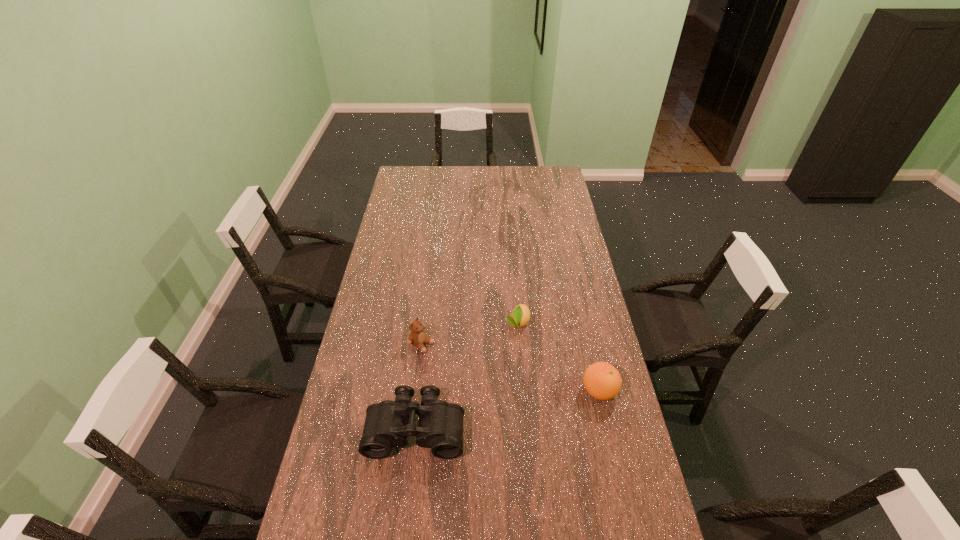
This screenshot has width=960, height=540. Find the location of `vacant area located 0.240m with leaves positioned above the shortest object`. vacant area located 0.240m with leaves positioned above the shortest object is located at coordinates (503, 388).

The image size is (960, 540). I want to click on blank space located with leaves positioned above the shortest object, so click(x=505, y=381).

You are a GUI agent. You are given a task and a screenshot of the screen. Output one action in this format:
    pyautogui.click(x=<x>, y=<y>)
    Task: Click on the free region located with leaves positioned above the shortest object
    
    Given the screenshot: What is the action you would take?
    pyautogui.click(x=498, y=409)

You are a GUI agent. You are given a task and a screenshot of the screen. Output one action in this format:
    pyautogui.click(x=<x>, y=<y>)
    Task: Click on the object situated at the left edge
    The image size is (960, 540).
    Given the screenshot: What is the action you would take?
    click(x=387, y=425)

Locate an element on the screen. object that is at the right edge is located at coordinates (601, 380).

This screenshot has height=540, width=960. I want to click on free space at the near edge, so click(x=457, y=519).

At what (x,y) coordinates should I click in order to perform the action: click on free space at the left edge of the desktop. Please return your answer as a coordinate pair (x, y). Looking at the image, I should click on (403, 313).

Where is `vacant space at the right edge of the desktop`? vacant space at the right edge of the desktop is located at coordinates (562, 213).

Where is `empty space that is in between the rightmost object and the shortest object`? The image size is (960, 540). empty space that is in between the rightmost object and the shortest object is located at coordinates 559,357.

Find the location of a particular element. The width and height of the screenshot is (960, 540). vacant area that lies between the binoculars and the shortest object is located at coordinates (468, 376).